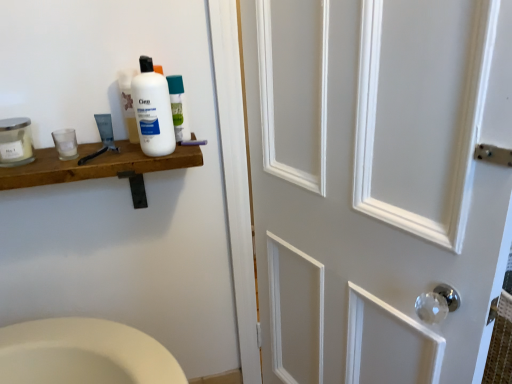
Question: From a real-world perspective, is white plastic bottle at upper left physically above clear glass mouthwash at left, the second mouthwash viewed from the right?

Choices:
 (A) yes
 (B) no

Answer: (A)

Question: Is white plastic bottle at upper left not within clear glass mouthwash at left, the second mouthwash viewed from the right?

Choices:
 (A) yes
 (B) no

Answer: (A)

Question: Would you say white plastic bottle at upper left contains clear glass mouthwash at left, which is the second mouthwash in left-to-right order?

Choices:
 (A) no
 (B) yes

Answer: (A)

Question: From a real-world perspective, is white plastic bottle at upper left located beneath clear glass mouthwash at left, the second mouthwash viewed from the right?

Choices:
 (A) yes
 (B) no

Answer: (B)

Question: Can you confirm if white plastic bottle at upper left is wider than clear glass mouthwash at left, the second mouthwash viewed from the right?

Choices:
 (A) no
 (B) yes

Answer: (B)

Question: Does white plastic bottle at upper left have a larger size compared to clear glass mouthwash at left, the second mouthwash viewed from the right?

Choices:
 (A) no
 (B) yes

Answer: (B)

Question: Is clear glass mouthwash at left, the second mouthwash viewed from the right, turned away from clear glass jar at left, the third mouthwash when ordered from right to left?

Choices:
 (A) yes
 (B) no

Answer: (B)

Question: From the image's perspective, does clear glass mouthwash at left, the second mouthwash viewed from the right, appear lower than clear glass jar at left, which is the first mouthwash from left to right?

Choices:
 (A) yes
 (B) no

Answer: (A)

Question: Would you consider clear glass mouthwash at left, the second mouthwash viewed from the right, to be distant from clear glass jar at left, which is the first mouthwash from left to right?

Choices:
 (A) yes
 (B) no

Answer: (B)

Question: Is clear glass mouthwash at left, which is the second mouthwash in left-to-right order, outside of clear glass jar at left, which is the first mouthwash from left to right?

Choices:
 (A) yes
 (B) no

Answer: (A)

Question: Is clear glass mouthwash at left, the second mouthwash viewed from the right, positioned before clear glass jar at left, which is the first mouthwash from left to right?

Choices:
 (A) no
 (B) yes

Answer: (A)

Question: Does clear glass mouthwash at left, which is the second mouthwash in left-to-right order, have a lesser height compared to clear glass jar at left, which is the first mouthwash from left to right?

Choices:
 (A) yes
 (B) no

Answer: (A)

Question: From a real-world perspective, is white painted wood door at right beneath clear glass jar at left, which is the first mouthwash from left to right?

Choices:
 (A) no
 (B) yes

Answer: (B)